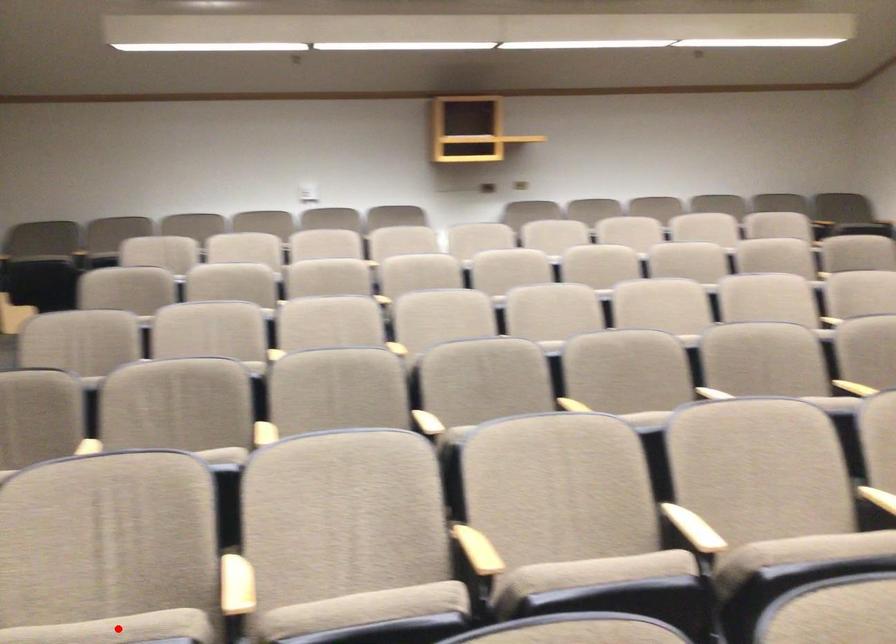
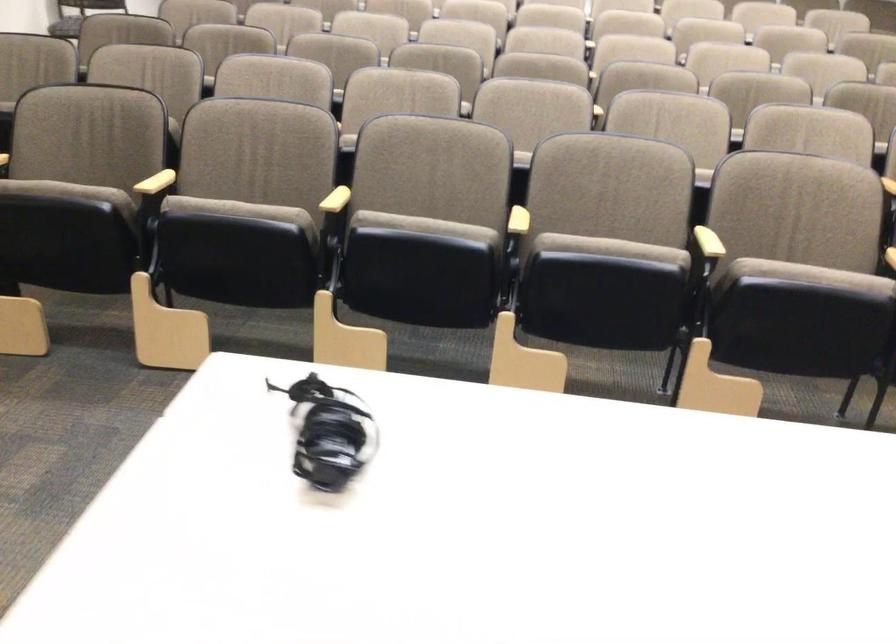
Question: I am providing you with two images of the same scene from different viewpoints. A red point is marked on the first image. Can you still see the location of the red point in image 2?

Choices:
 (A) Yes
 (B) No

Answer: (B)